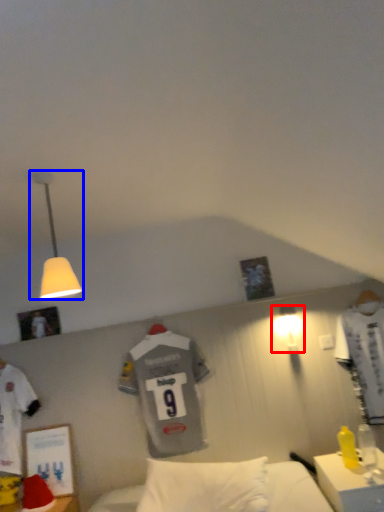
Question: Which object appears closest to the camera in this image, lamp (highlighted by a red box) or lamp (highlighted by a blue box)?

Choices:
 (A) lamp
 (B) lamp

Answer: (B)